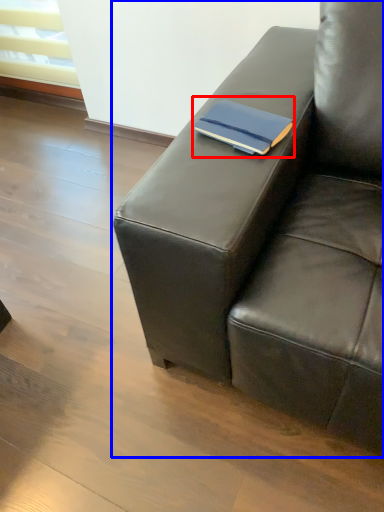
Question: Which of the following is the farthest to the observer, paperback book (highlighted by a red box) or studio couch (highlighted by a blue box)?

Choices:
 (A) paperback book
 (B) studio couch

Answer: (A)